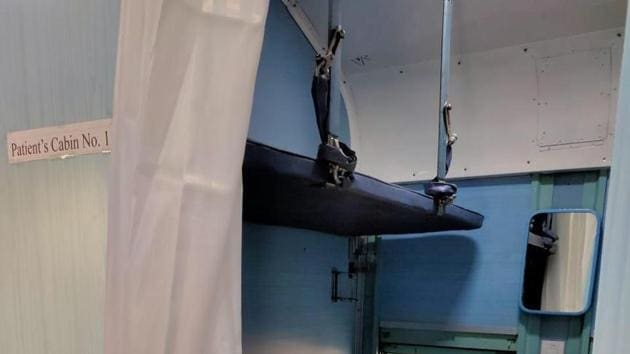
You are a GUI agent. You are given a task and a screenshot of the screen. Output one action in this format:
    pyautogui.click(x=<x>, y=<y>)
    Task: Click on the teal paneling on wall
    
    Given the screenshot: What is the action you would take?
    pyautogui.click(x=450, y=342), pyautogui.click(x=542, y=186), pyautogui.click(x=593, y=190)